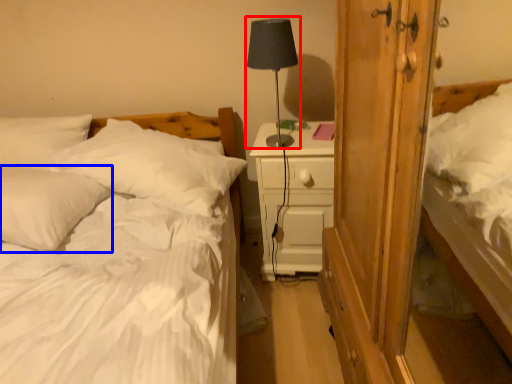
Question: Which object appears closest to the camera in this image, table lamp (highlighted by a red box) or pillow (highlighted by a blue box)?

Choices:
 (A) table lamp
 (B) pillow

Answer: (B)